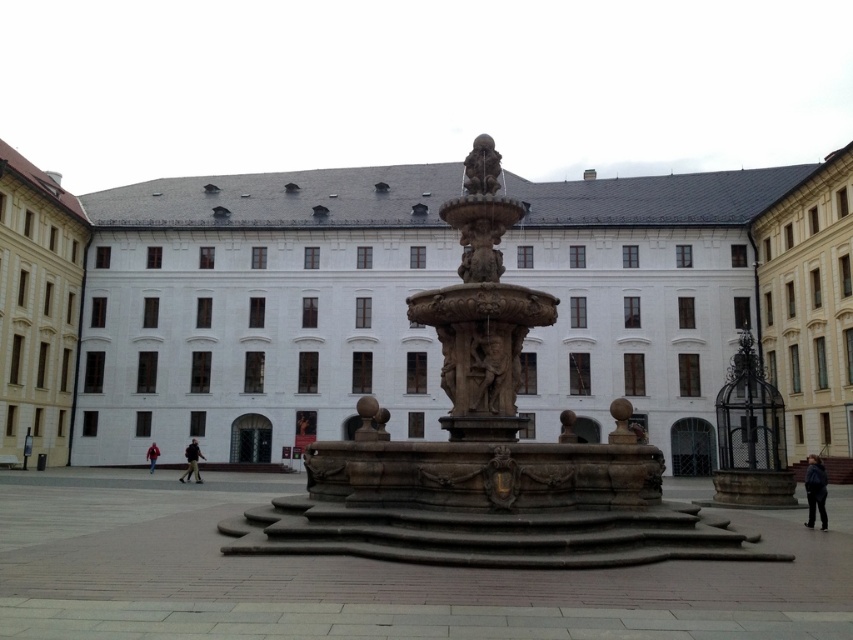
You are standing at the entrance of the square, which is located at point 0.0, 0.0. You want to walk directly to the brown stone fountain at center. What direction should you head in?

Since the brown stone fountain at center is located at point (369, 576), you should head in the positive x and positive y direction to reach it from the entrance at (0, 0).

You are standing in the square and see both the dark blue jacket at lower right and the red leather jacket at lower left. Which jacket is located to the right of the other?

The dark blue jacket at lower right is positioned on the right side of the red leather jacket at lower left.